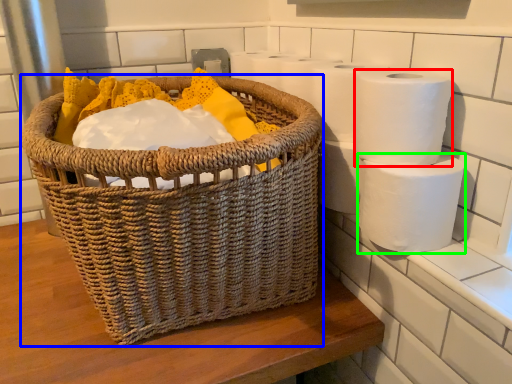
Question: Considering the real-world distances, which object is closest to toilet paper (highlighted by a red box)? picnic basket (highlighted by a blue box) or toilet paper (highlighted by a green box).

Choices:
 (A) picnic basket
 (B) toilet paper

Answer: (B)